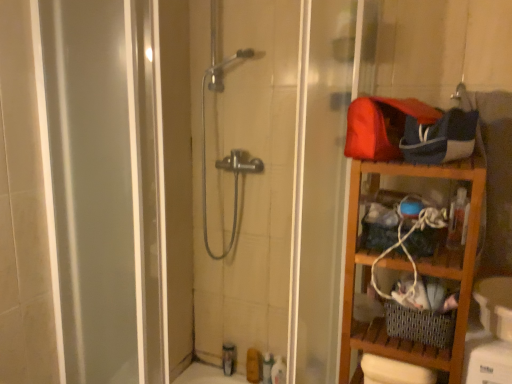
Question: Is matte brown soap at lower center, which is counted as the 2th toiletry, starting from the left, in front of wooden shelf at right?

Choices:
 (A) yes
 (B) no

Answer: (B)

Question: Considering the relative sizes of matte brown soap at lower center, which is counted as the 2th toiletry, starting from the left, and wooden shelf at right in the image provided, is matte brown soap at lower center, which is counted as the 2th toiletry, starting from the left, wider than wooden shelf at right?

Choices:
 (A) yes
 (B) no

Answer: (B)

Question: Is matte brown soap at lower center, arranged as the 3th toiletry when viewed from the right, thinner than wooden shelf at right?

Choices:
 (A) no
 (B) yes

Answer: (B)

Question: Can you confirm if matte brown soap at lower center, which is counted as the 2th toiletry, starting from the left, is shorter than wooden shelf at right?

Choices:
 (A) yes
 (B) no

Answer: (A)

Question: Is matte brown soap at lower center, which is counted as the 2th toiletry, starting from the left, taller than wooden shelf at right?

Choices:
 (A) yes
 (B) no

Answer: (B)

Question: Relative to matte brown soap at lower center, which is counted as the 2th toiletry, starting from the left, is translucent plastic toiletries at lower center, which is counted as the 1th toiletry, starting from the left, in front or behind?

Choices:
 (A) behind
 (B) front

Answer: (A)

Question: Is point (229, 352) positioned closer to the camera than point (254, 382)?

Choices:
 (A) closer
 (B) farther

Answer: (B)

Question: From the image's perspective, is translucent plastic toiletries at lower center, placed as the fourth toiletry when sorted from right to left, above or below matte brown soap at lower center, arranged as the 3th toiletry when viewed from the right?

Choices:
 (A) below
 (B) above

Answer: (B)

Question: Is translucent plastic toiletries at lower center, which is counted as the 1th toiletry, starting from the left, taller or shorter than matte brown soap at lower center, which is counted as the 2th toiletry, starting from the left?

Choices:
 (A) short
 (B) tall

Answer: (B)

Question: Choose the correct answer: Is translucent plastic toiletries at lower center, placed as the fourth toiletry when sorted from right to left, inside translucent plastic bottle at lower center, marked as the 2th toiletry in a right-to-left arrangement, or outside it?

Choices:
 (A) outside
 (B) inside

Answer: (A)

Question: In terms of width, does translucent plastic toiletries at lower center, which is counted as the 1th toiletry, starting from the left, look wider or thinner when compared to translucent plastic bottle at lower center, the third toiletry positioned from the left?

Choices:
 (A) wide
 (B) thin

Answer: (B)

Question: From a real-world perspective, is translucent plastic toiletries at lower center, placed as the fourth toiletry when sorted from right to left, physically located above or below translucent plastic bottle at lower center, marked as the 2th toiletry in a right-to-left arrangement?

Choices:
 (A) above
 (B) below

Answer: (B)

Question: From the image's perspective, is translucent plastic toiletries at lower center, which is counted as the 1th toiletry, starting from the left, located above or below translucent plastic bottle at lower center, the third toiletry positioned from the left?

Choices:
 (A) above
 (B) below

Answer: (A)

Question: Is wooden shelf at right spatially inside matte brown soap at lower center, which is counted as the 2th toiletry, starting from the left, or outside of it?

Choices:
 (A) inside
 (B) outside

Answer: (B)

Question: In terms of height, does wooden shelf at right look taller or shorter compared to matte brown soap at lower center, which is counted as the 2th toiletry, starting from the left?

Choices:
 (A) tall
 (B) short

Answer: (A)